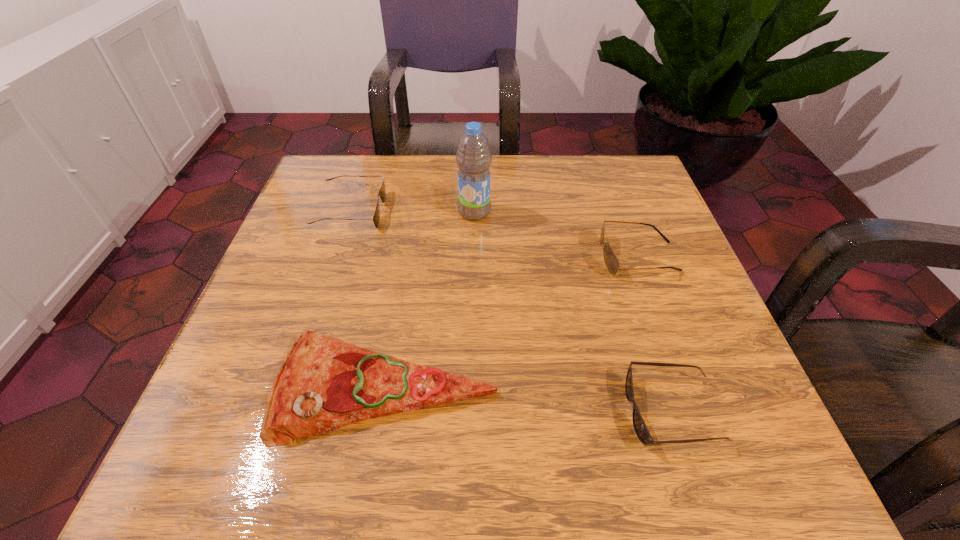
The height and width of the screenshot is (540, 960). Find the location of `blank space that satisfies the following two spatial constraints: 1. on the front-facing side of the second shortest sunglasses; 2. on the left side of the pizza`. blank space that satisfies the following two spatial constraints: 1. on the front-facing side of the second shortest sunglasses; 2. on the left side of the pizza is located at coordinates (293, 388).

Identify the location of vacant position in the image that satisfies the following two spatial constraints: 1. on the front-facing side of the leftmost sunglasses; 2. on the right side of the water bottle. (350, 212).